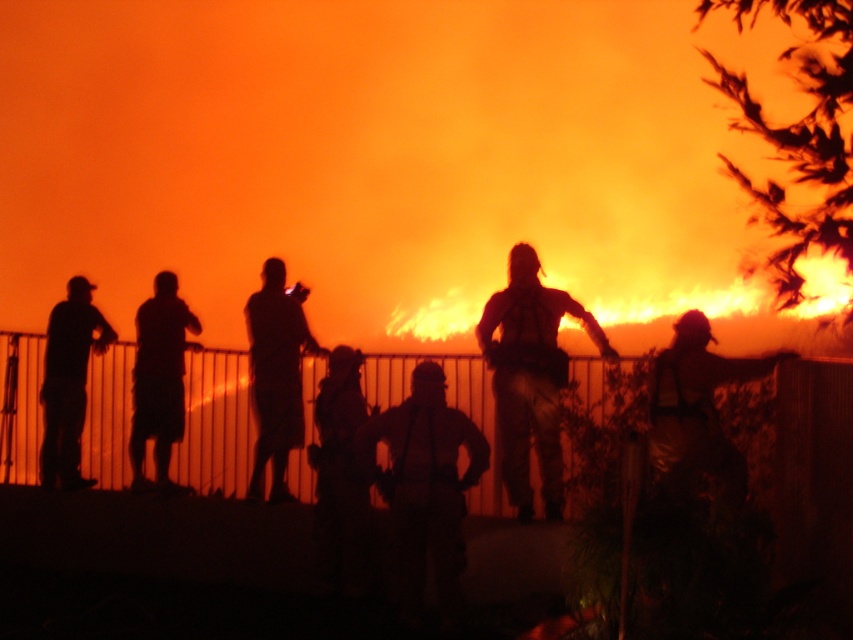
Does silhouette figure at center have a larger size compared to matte black shirt at left?

No.

Find the location of `silhouette figure at center`. silhouette figure at center is located at coordinates (276, 376).

Which of these two, metallic gold helmet at center or dark matte shorts at left, stands taller?

dark matte shorts at left

Which is in front, point (659, 468) or point (165, 412)?

Point (659, 468) is more forward.

The image size is (853, 640). I want to click on metallic gold helmet at center, so click(x=697, y=412).

Which is in front, point (517, 304) or point (59, 368)?

Point (517, 304) is in front.

Which is below, dark brown leather jacket at center or matte black shirt at left?

matte black shirt at left is lower down.

Where is `dark brown leather jacket at center`? The image size is (853, 640). dark brown leather jacket at center is located at coordinates (531, 376).